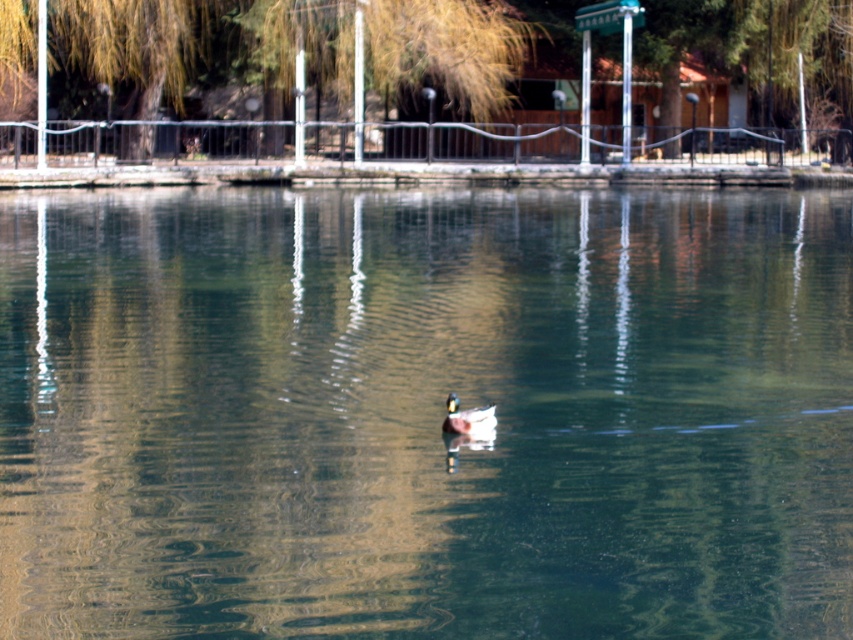
Question: Which point is closer to the camera?

Choices:
 (A) clear water at duck center
 (B) green glossy duck at center

Answer: (A)

Question: Is clear water at duck center thinner than green glossy duck at center?

Choices:
 (A) yes
 (B) no

Answer: (B)

Question: Is clear water at duck center to the left of green glossy duck at center from the viewer's perspective?

Choices:
 (A) no
 (B) yes

Answer: (A)

Question: Is clear water at duck center smaller than green glossy duck at center?

Choices:
 (A) no
 (B) yes

Answer: (A)

Question: Which point is farther to the camera?

Choices:
 (A) clear water at duck center
 (B) green glossy duck at center

Answer: (B)